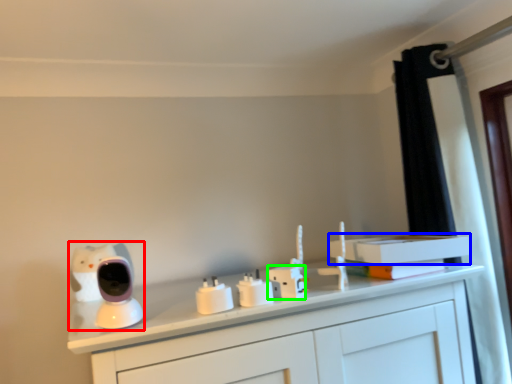
Question: Estimate the real-world distances between objects in this image. Which object is closer to toy (highlighted by a red box), book (highlighted by a blue box) or electric outlet (highlighted by a green box)?

Choices:
 (A) book
 (B) electric outlet

Answer: (B)